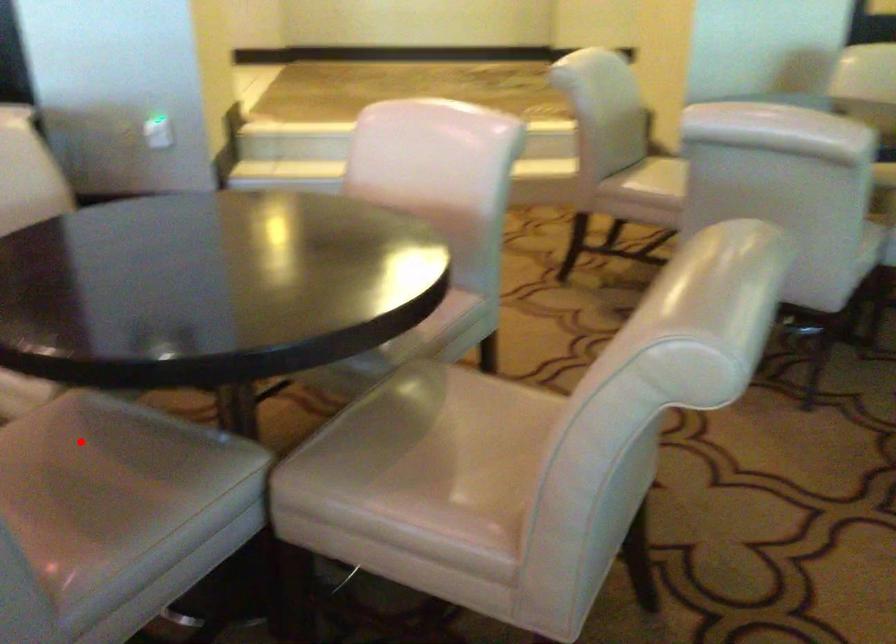
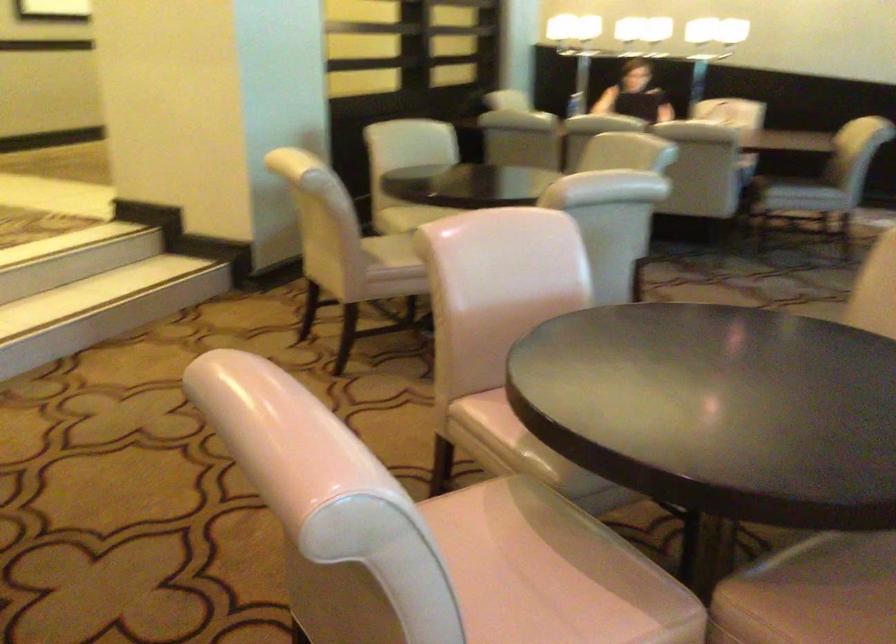
Find the pixel in the second image that matches the highlighted location in the first image.

(828, 590)